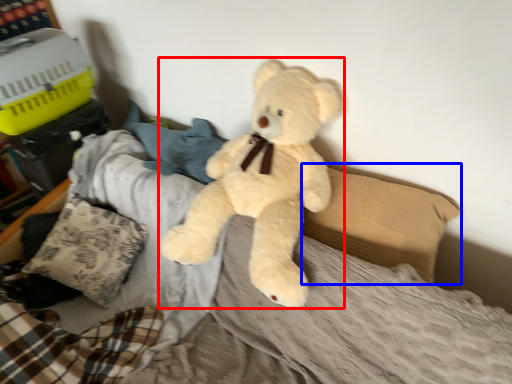
Question: Which of the following is the closest to the observer, teddy bear (highlighted by a red box) or pillow (highlighted by a blue box)?

Choices:
 (A) teddy bear
 (B) pillow

Answer: (A)